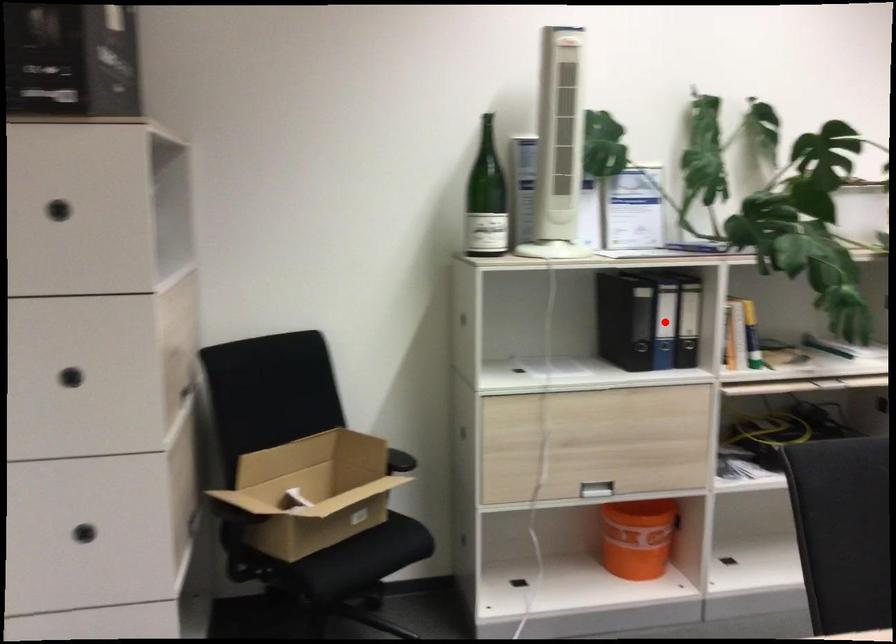
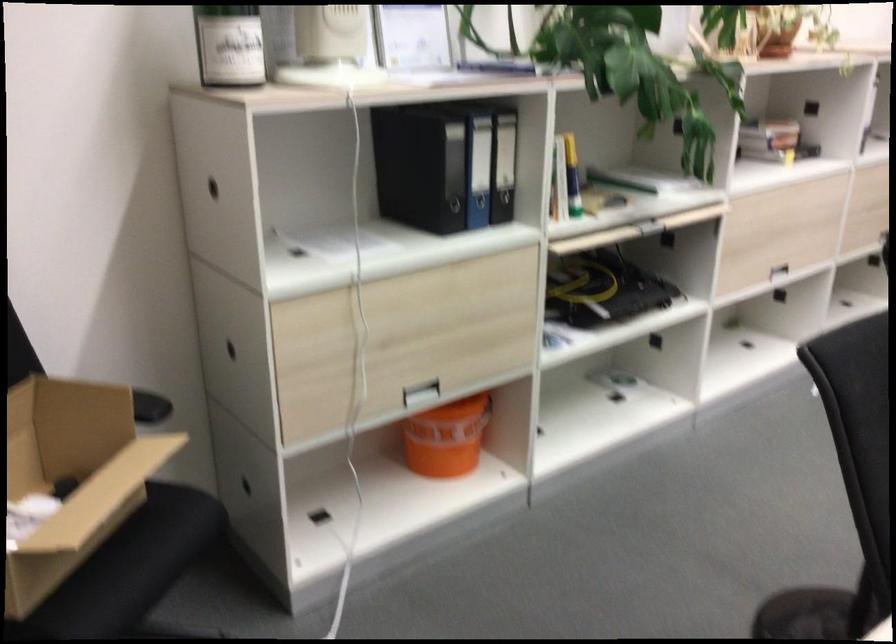
Question: I am providing you with two images of the same scene from different viewpoints. A red point is shown in image1. For the corresponding object point in image2, is it positioned nearer or farther from the camera?

Choices:
 (A) Nearer
 (B) Farther

Answer: (A)